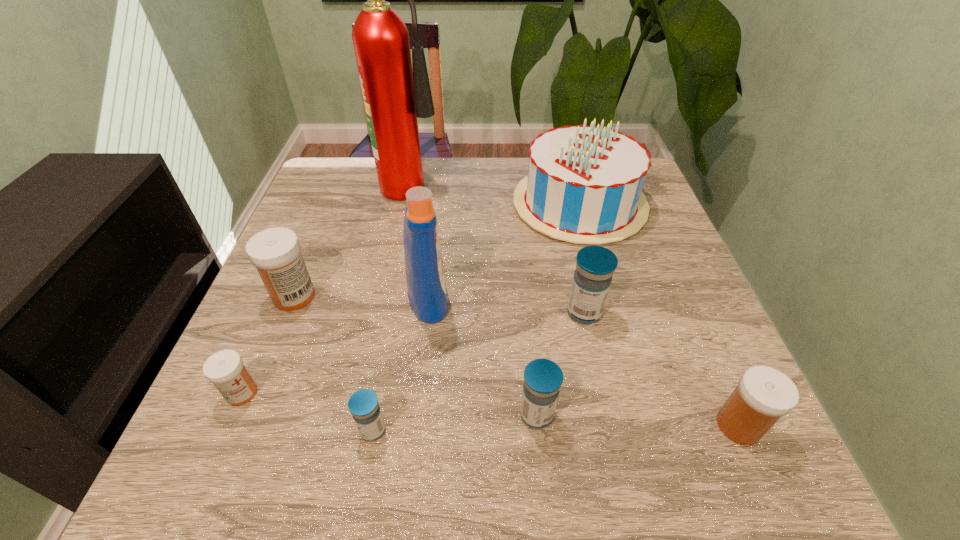
In order to click on vacant space located on the left of the rightmost medicine in this screenshot , I will do `click(487, 426)`.

Find the location of `vacant area situated on the front of the second smallest blue medicine`. vacant area situated on the front of the second smallest blue medicine is located at coordinates (543, 482).

Locate an element on the screen. This screenshot has width=960, height=540. vacant area located 0.240m on the right of the smallest white medicine is located at coordinates pos(395,393).

You are a GUI agent. You are given a task and a screenshot of the screen. Output one action in this format:
    pyautogui.click(x=<x>, y=<y>)
    Task: Click on the blank area located 0.250m on the right of the fourth medicine from right to left
    
    Given the screenshot: What is the action you would take?
    pyautogui.click(x=539, y=430)

Image resolution: width=960 pixels, height=540 pixels. What are the coordinates of `fire extinguisher that is positioned at the far edge` in the screenshot? It's located at (394, 96).

Identify the location of birthday cake that is at the far edge. (584, 185).

In order to click on birthday cake positioned at the right edge in this screenshot , I will do `click(584, 185)`.

You are a GUI agent. You are given a task and a screenshot of the screen. Output one action in this format:
    pyautogui.click(x=<x>, y=<y>)
    Task: Click on the medicine at the right edge
    
    Given the screenshot: What is the action you would take?
    pyautogui.click(x=764, y=394)

Find the location of a particular element. This screenshot has height=540, width=960. object at the far right corner is located at coordinates (584, 185).

The width and height of the screenshot is (960, 540). What are the coordinates of `object present at the near right corner` in the screenshot? It's located at (764, 394).